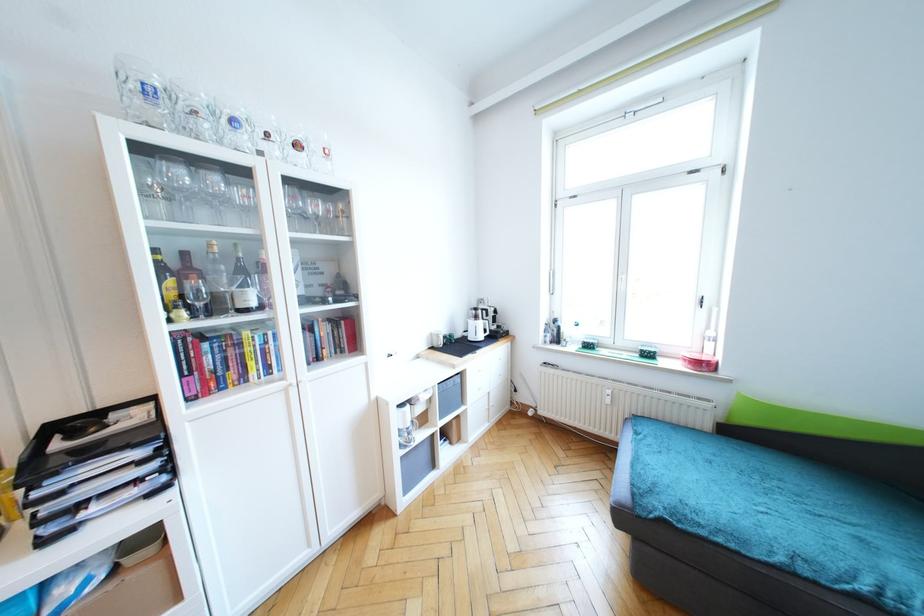
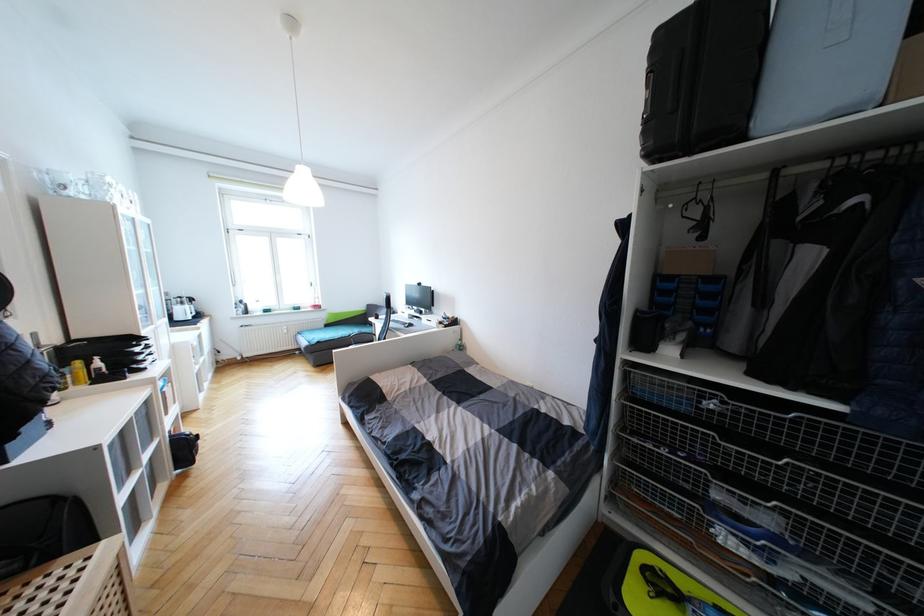
Where in the second image is the point corresponding to (480,318) from the first image?

(186, 305)